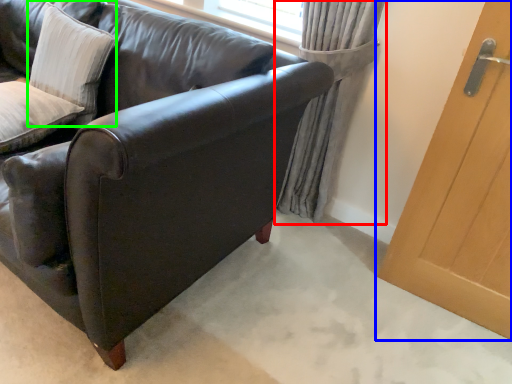
Question: Which is farther away from curtain (highlighted by a red box)? door (highlighted by a blue box) or pillow (highlighted by a green box)?

Choices:
 (A) door
 (B) pillow

Answer: (B)